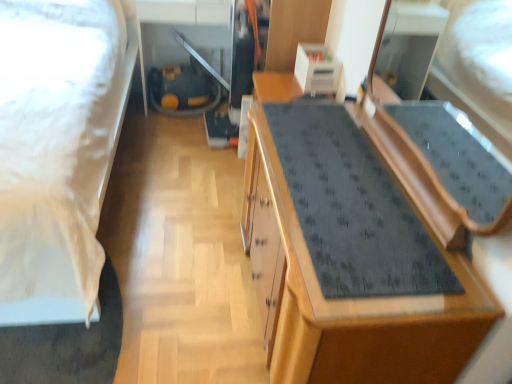
I want to click on wooden dresser at center, so click(371, 299).

The height and width of the screenshot is (384, 512). What do you see at coordinates (371, 299) in the screenshot?
I see `wooden dresser at center` at bounding box center [371, 299].

Describe the element at coordinates (58, 150) in the screenshot. The width and height of the screenshot is (512, 384). I see `white satin bed at left` at that location.

Find the location of a particular element. white satin bed at left is located at coordinates (58, 150).

At what (x,y) coordinates should I click in order to perform the action: click on wooden dresser at center. Please return your answer as a coordinate pair (x, y). This screenshot has width=512, height=384. Looking at the image, I should click on (371, 299).

Based on the photo, is wooden dresser at center at the right side of white satin bed at left?

Yes.

In the scene shown: Does wooden dresser at center come in front of white satin bed at left?

No, wooden dresser at center is further to the viewer.

Is point (458, 252) more distant than point (9, 11)?

No, it is not.

From the image's perspective, is wooden dresser at center located beneath white satin bed at left?

Yes, from the image's perspective, wooden dresser at center is below white satin bed at left.

From a real-world perspective, is wooden dresser at center physically below white satin bed at left?

Yes, from a real-world perspective, wooden dresser at center is beneath white satin bed at left.

Can you confirm if wooden dresser at center is thinner than white satin bed at left?

Correct, the width of wooden dresser at center is less than that of white satin bed at left.

Looking at this image, between wooden dresser at center and white satin bed at left, which one has more height?

white satin bed at left.

Does wooden dresser at center have a smaller size compared to white satin bed at left?

Yes.

Would you say wooden dresser at center is inside or outside white satin bed at left?

The correct answer is: outside.

Would you consider wooden dresser at center to be distant from white satin bed at left?

No, there isn't a large distance between wooden dresser at center and white satin bed at left.

Is wooden dresser at center positioned with its back to white satin bed at left?

No, white satin bed at left is not at the back of wooden dresser at center.

In the image, there is a white satin bed at left. In order to click on cabinetry below it (from the image's perspective) in this screenshot , I will do click(371, 299).

Between white satin bed at left and wooden dresser at center, which one appears on the right side from the viewer's perspective?

From the viewer's perspective, wooden dresser at center appears more on the right side.

Does white satin bed at left come behind wooden dresser at center?

No, it is in front of wooden dresser at center.

Is point (66, 194) closer or farther from the camera than point (406, 321)?

Point (66, 194) is farther from the camera than point (406, 321).

From the picture: From the image's perspective, is white satin bed at left above wooden dresser at center?

Yes.

From a real-world perspective, between white satin bed at left and wooden dresser at center, who is vertically lower?

From a 3D spatial view, wooden dresser at center is below.

Considering the sizes of white satin bed at left and wooden dresser at center in the image, is white satin bed at left wider or thinner than wooden dresser at center?

In the image, white satin bed at left appears to be wider than wooden dresser at center.

In terms of height, does white satin bed at left look taller or shorter compared to wooden dresser at center?

Clearly, white satin bed at left is taller compared to wooden dresser at center.

Considering the relative sizes of white satin bed at left and wooden dresser at center in the image provided, is white satin bed at left bigger than wooden dresser at center?

Yes, white satin bed at left is bigger than wooden dresser at center.

Would you say white satin bed at left is inside or outside wooden dresser at center?

white satin bed at left is not inside wooden dresser at center, it's outside.

Is white satin bed at left positioned far away from wooden dresser at center?

white satin bed at left is near wooden dresser at center, not far away.

Could you tell me if white satin bed at left is facing wooden dresser at center?

No, white satin bed at left is not oriented towards wooden dresser at center.

What's the angular difference between white satin bed at left and wooden dresser at center's facing directions?

91.2 degrees.

Measure the distance between white satin bed at left and wooden dresser at center.

They are 98.35 centimeters apart.

The width and height of the screenshot is (512, 384). I want to click on bed lying in front of the wooden dresser at center, so click(58, 150).

Locate an element on the screen. The height and width of the screenshot is (384, 512). bed lying above the wooden dresser at center (from the image's perspective) is located at coordinates (58, 150).

Where is `bed above the wooden dresser at center (from a real-world perspective)`? bed above the wooden dresser at center (from a real-world perspective) is located at coordinates (58, 150).